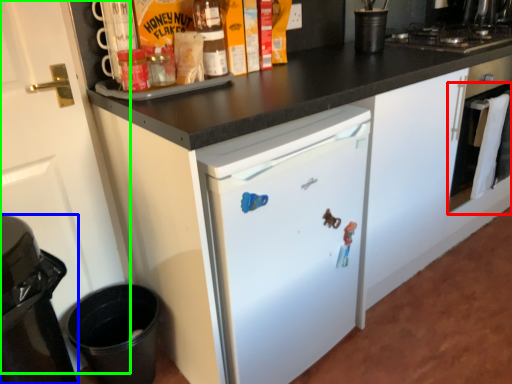
Question: Based on their relative distances, which object is nearer to oven (highlighted by a red box)? Choose from home appliance (highlighted by a blue box) and door (highlighted by a green box).

Choices:
 (A) home appliance
 (B) door

Answer: (B)